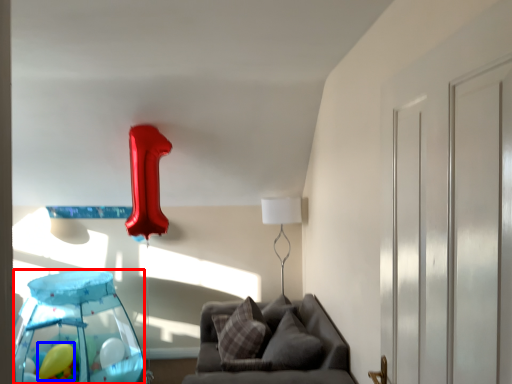
Question: Which object is further to the camera taking this photo, glass table (highlighted by a red box) or balloon (highlighted by a blue box)?

Choices:
 (A) glass table
 (B) balloon

Answer: (B)